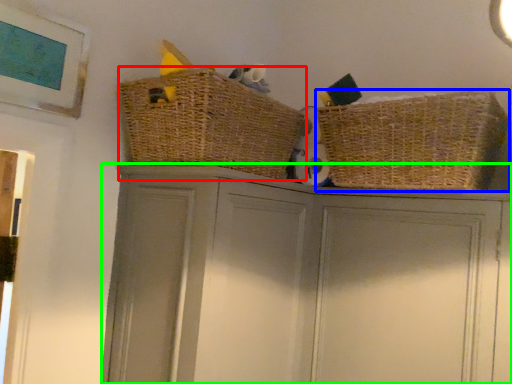
Question: Considering the real-world distances, which object is farthest from basket (highlighted by a red box)? basket (highlighted by a blue box) or cupboard (highlighted by a green box)?

Choices:
 (A) basket
 (B) cupboard

Answer: (A)